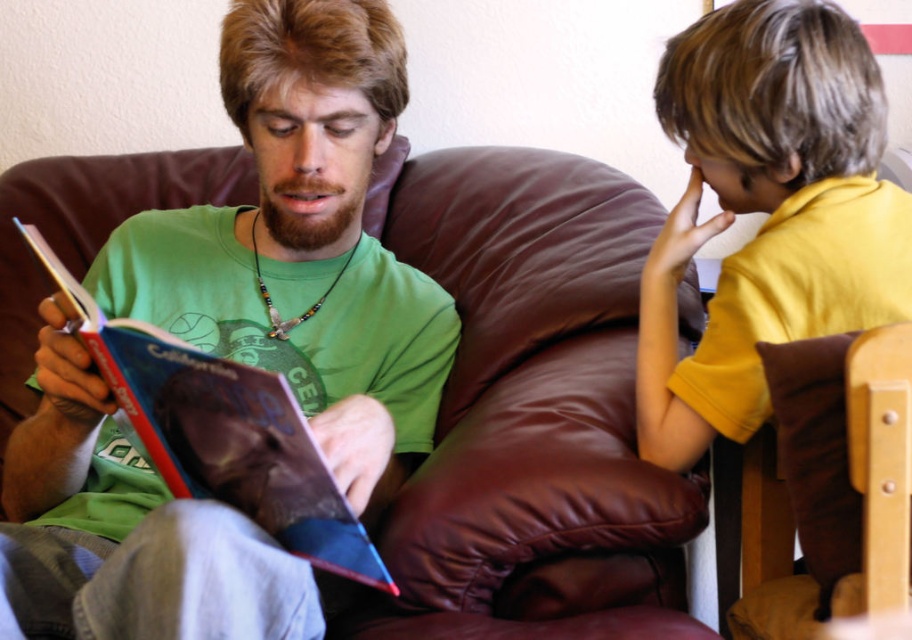
Does point (436, 422) come behind point (241, 371)?

Yes, it is.

What are the coordinates of `brown leather couch at center` in the screenshot? It's located at (532, 416).

Measure the distance between brown leather couch at center and camera.

brown leather couch at center is 34.43 inches away from camera.

Where is `brown leather couch at center`? This screenshot has height=640, width=912. brown leather couch at center is located at coordinates (532, 416).

Does point (758, 273) come in front of point (192, 400)?

No, (758, 273) is further to viewer.

Locate an element on the screen. yellow matte shirt at upper right is located at coordinates (765, 211).

Between point (448, 515) and point (707, 378), which one is positioned in front?

Positioned in front is point (448, 515).

Between point (486, 284) and point (765, 29), which one is positioned behind?

Positioned behind is point (486, 284).

I want to click on brown leather couch at center, so click(x=532, y=416).

Identify the location of brown leather couch at center. (532, 416).